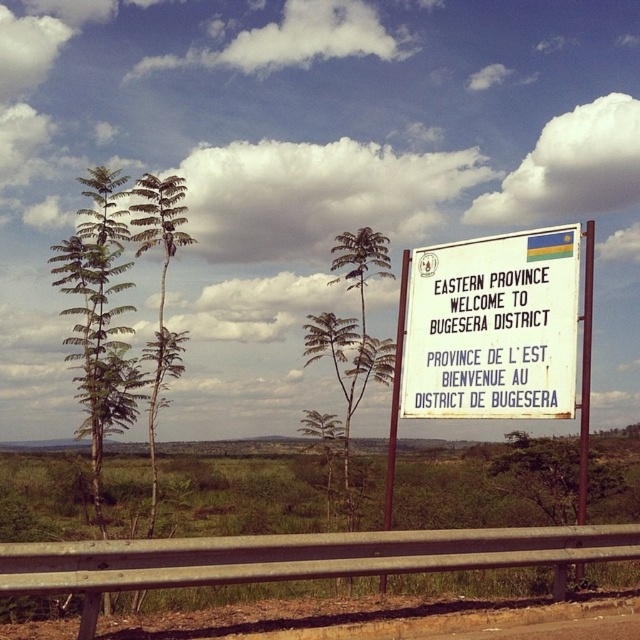
Which is more to the left, white paper sign at upper right or green leafy tree at center?

From the viewer's perspective, green leafy tree at center appears more on the left side.

Describe the element at coordinates (492, 326) in the screenshot. I see `white paper sign at upper right` at that location.

This screenshot has width=640, height=640. In order to click on white paper sign at upper right in this screenshot , I will do `click(492, 326)`.

Which is behind, point (465, 388) or point (339, 348)?

Positioned behind is point (339, 348).

Is white paper sign at center behind green leafy tree at center?

That is False.

Identify the location of white paper sign at center. (493, 333).

Is white paper sign at center wider than white paper sign at upper right?

Correct, the width of white paper sign at center exceeds that of white paper sign at upper right.

Between white paper sign at center and white paper sign at upper right, which one appears on the right side from the viewer's perspective?

white paper sign at upper right is more to the right.

You are a GUI agent. You are given a task and a screenshot of the screen. Output one action in this format:
    pyautogui.click(x=<x>, y=<y>)
    Task: Click on the white paper sign at center
    
    Given the screenshot: What is the action you would take?
    pyautogui.click(x=493, y=333)